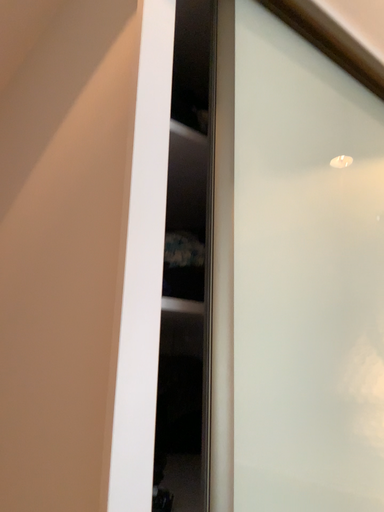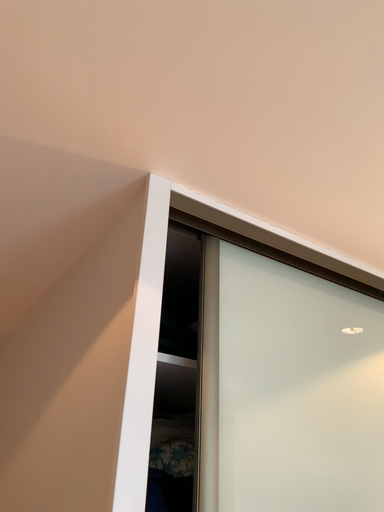
Question: Which way did the camera rotate in the video?

Choices:
 (A) rotated left
 (B) rotated right

Answer: (A)